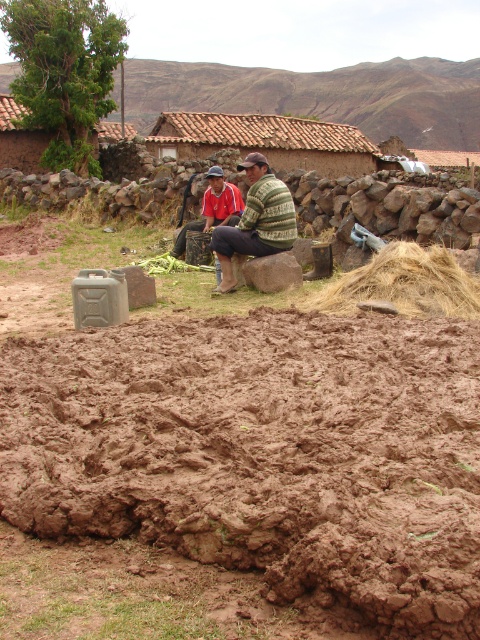
Question: Is the position of brown muddy field at center more distant than that of red fabric squat at center?

Choices:
 (A) yes
 (B) no

Answer: (B)

Question: Among these objects, which one is farthest from the camera?

Choices:
 (A) red fabric squat at center
 (B) green knitted sweater at center

Answer: (A)

Question: Is brown muddy field at center to the right of golden straw at right from the viewer's perspective?

Choices:
 (A) yes
 (B) no

Answer: (B)

Question: Among these objects, which one is nearest to the camera?

Choices:
 (A) red fabric squat at center
 (B) green knitted sweater at center
 (C) brown muddy field at center
 (D) golden straw at right

Answer: (C)

Question: Does golden straw at right appear over green knitted sweater at center?

Choices:
 (A) yes
 (B) no

Answer: (B)

Question: Which of these objects is positioned closest to the golden straw at right?

Choices:
 (A) brown muddy field at center
 (B) green knitted sweater at center
 (C) red fabric squat at center

Answer: (B)